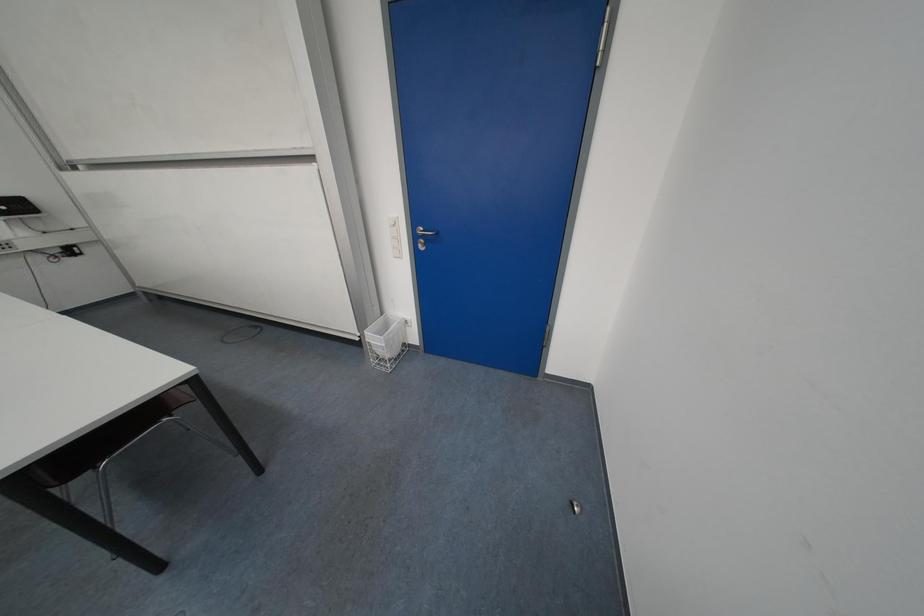
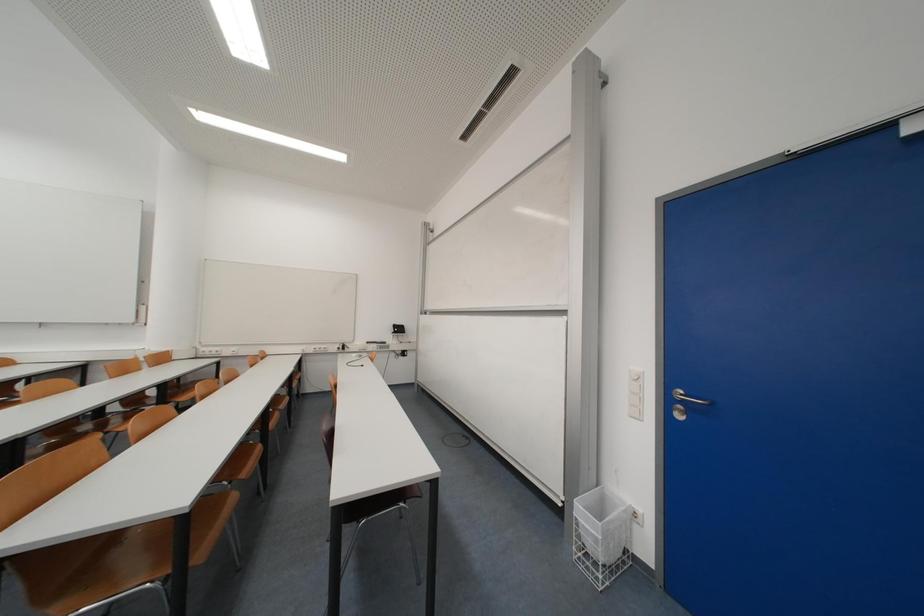
The images are taken continuously from a first-person perspective. In which direction is your viewpoint rotating?

The camera's rotation is toward left-up.